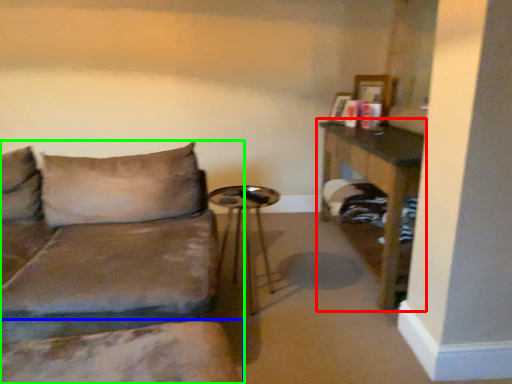
Question: Considering the real-world distances, which object is farthest from table (highlighted by a red box)? swivel chair (highlighted by a blue box) or studio couch (highlighted by a green box)?

Choices:
 (A) swivel chair
 (B) studio couch

Answer: (A)